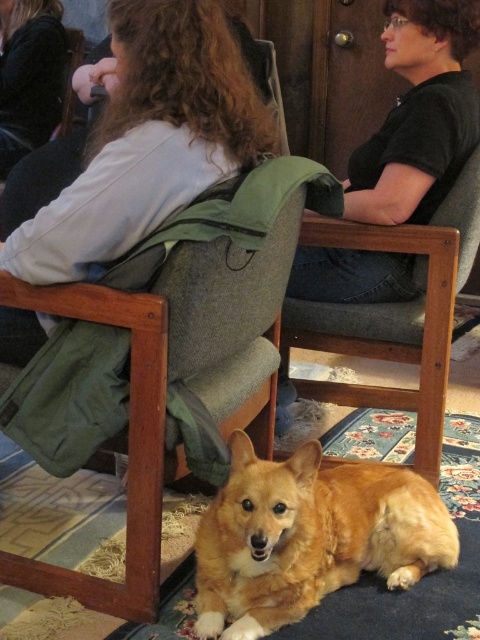
You are a photographer trying to capture a candid shot of the black cotton shirt at upper center without the golden fur dog at lower center blocking the view. Is the dog positioned in front of or behind the shirt?

The golden fur dog at lower center is closer to the viewer than the black cotton shirt at upper center, so the dog is positioned in front of the shirt and may block the view.

You are a photographer trying to capture a photo of the golden fur dog at lower center and the black cotton shirt at upper center. Which object should you focus on first if you want to ensure both are in focus, considering their sizes?

The golden fur dog at lower center is smaller than the black cotton shirt at upper center, so you should focus on the black cotton shirt at upper center first to ensure both are in focus.

Based on the photo, you are a photographer trying to capture a group photo of everyone in the scene. You notice the golden fur dog at lower center and the dark brown hair at upper left. Which subject should you adjust to ensure both are fully visible in the frame?

You should adjust the golden fur dog at lower center because it is in front of the dark brown hair at upper left, so moving the dog would allow both subjects to be visible without obstruction.